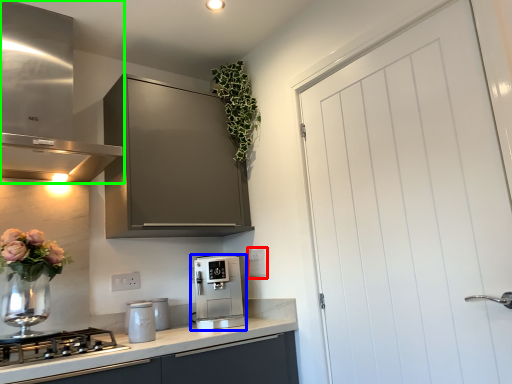
Question: Considering the real-world distances, which object is closest to electric outlet (highlighted by a red box)? kitchen appliance (highlighted by a blue box) or home appliance (highlighted by a green box).

Choices:
 (A) kitchen appliance
 (B) home appliance

Answer: (A)